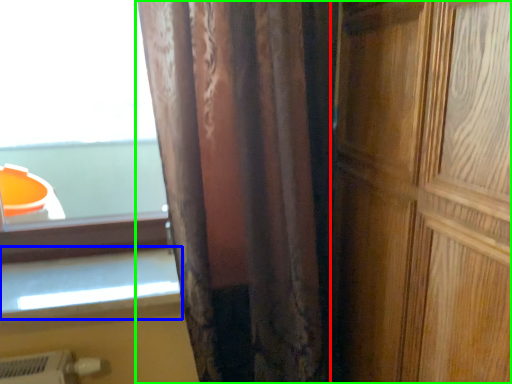
Question: Considering the real-world distances, which object is farthest from door (highlighted by a red box)? window sill (highlighted by a blue box) or curtain (highlighted by a green box)?

Choices:
 (A) window sill
 (B) curtain

Answer: (A)